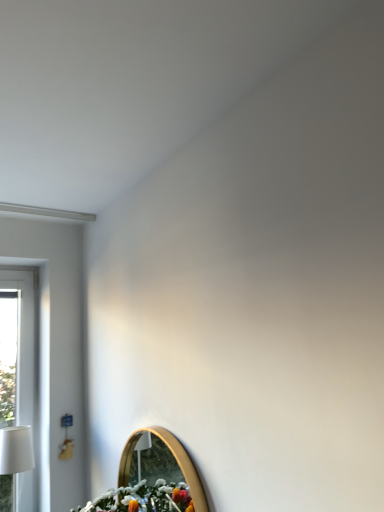
The image size is (384, 512). Identify the location of white fabric lampshade at left. (14, 462).

Image resolution: width=384 pixels, height=512 pixels. What do you see at coordinates (14, 462) in the screenshot?
I see `white fabric lampshade at left` at bounding box center [14, 462].

Identify the location of white fabric lampshade at left. (14, 462).